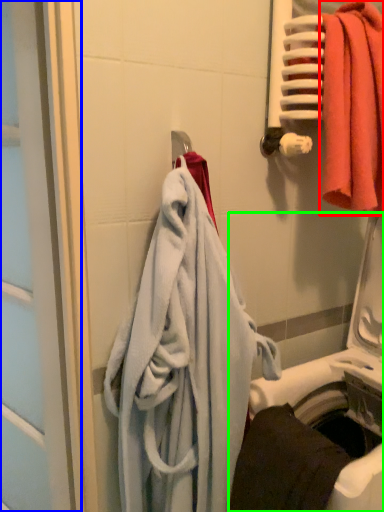
Question: Estimate the real-world distances between objects in this image. Which object is farther from towel (highlighted by a red box), screen door (highlighted by a blue box) or washing machine (highlighted by a green box)?

Choices:
 (A) screen door
 (B) washing machine

Answer: (A)